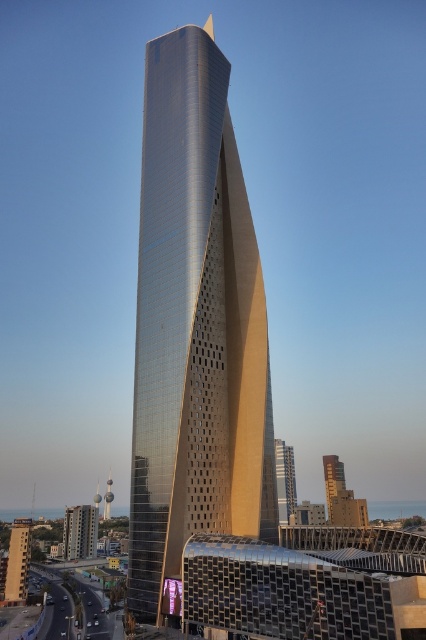
You are an architect standing in front of the matte glass building at lower left and the gold textured tower at center. Which structure is nearer to you?

The matte glass building at lower left is closer to the viewer than the gold textured tower at center, so the matte glass building at lower left is nearer.

You are an architect analyzing the skyscraper design. You notice two central structures labeled as the gold metallic building at center and the gold textured glass tower at center. Based on the scene, which one is positioned further away from the observer?

The gold textured glass tower at center is positioned further away from the observer because it is described as being behind the gold metallic building at center.

You are a drone operator tasked with flying a drone between the matte glass building at lower left and the gold textured tower at center. The drone has a maximum flight distance of 80 meters. Can the drone safely fly between them without exceeding its range?

The matte glass building at lower left and gold textured tower at center are 84.38 meters apart from each other. Since the drone can only fly up to 80 meters, it cannot safely fly between them without exceeding its range.